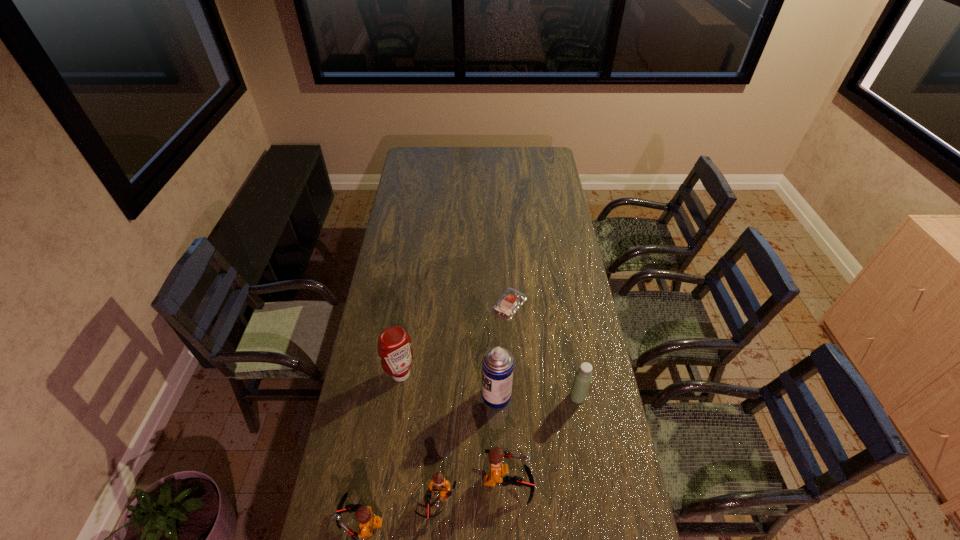
What are the coordinates of `vacant point at the right edge` in the screenshot? It's located at (587, 456).

In the image, there is a desktop. In order to click on vacant space at the far left corner in this screenshot , I will do [x=415, y=166].

In the image, there is a desktop. Where is `vacant space at the far right corner`? This screenshot has height=540, width=960. vacant space at the far right corner is located at coordinates (536, 156).

Find the location of `vacant area that lies between the sixth shortest object and the aerosol can`. vacant area that lies between the sixth shortest object and the aerosol can is located at coordinates (448, 385).

Where is `vacant space that is in between the aerosol can and the rightmost Lego`? The height and width of the screenshot is (540, 960). vacant space that is in between the aerosol can and the rightmost Lego is located at coordinates (502, 439).

What are the coordinates of `vacant area between the sixth shortest object and the rightmost Lego` in the screenshot? It's located at (455, 428).

The height and width of the screenshot is (540, 960). Find the location of `vacant area between the steak and the sixth shortest object`. vacant area between the steak and the sixth shortest object is located at coordinates (455, 339).

At what (x,y) coordinates should I click in order to perform the action: click on vacant area that lies between the farthest object and the second Lego from left to right. Please return your answer as a coordinate pair (x, y). The height and width of the screenshot is (540, 960). Looking at the image, I should click on (472, 403).

You are a GUI agent. You are given a task and a screenshot of the screen. Output one action in this format:
    pyautogui.click(x=<x>, y=<y>)
    Task: Click on the free spot between the third object from left to right and the aerosol can
    The image size is (960, 540).
    Given the screenshot: What is the action you would take?
    pyautogui.click(x=467, y=449)

Identify the location of free space between the fifth object from right to left and the second tallest object. (419, 438).